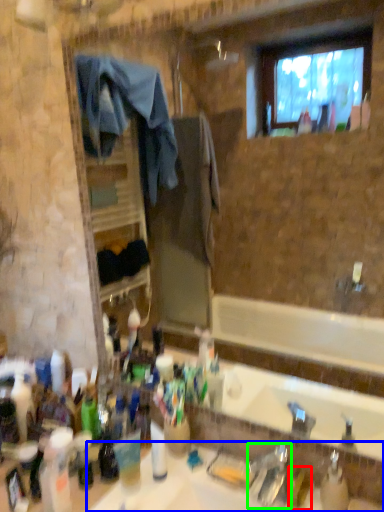
Question: Which object is positioned farthest from toiletry (highlighted by a red box)? Select from sink (highlighted by a blue box) and faucet (highlighted by a green box).

Choices:
 (A) sink
 (B) faucet

Answer: (A)